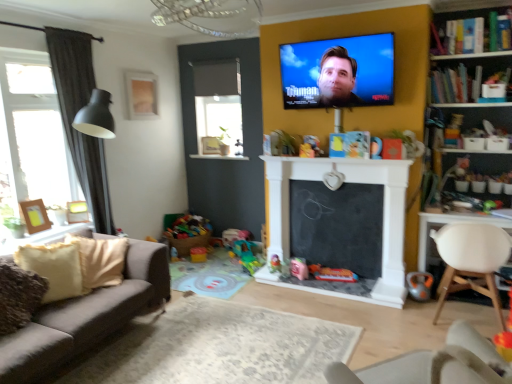
The image size is (512, 384). Identify the location of vacant region to the left of white matte chair at right, the 2th chair in the front-to-back sequence. (402, 321).